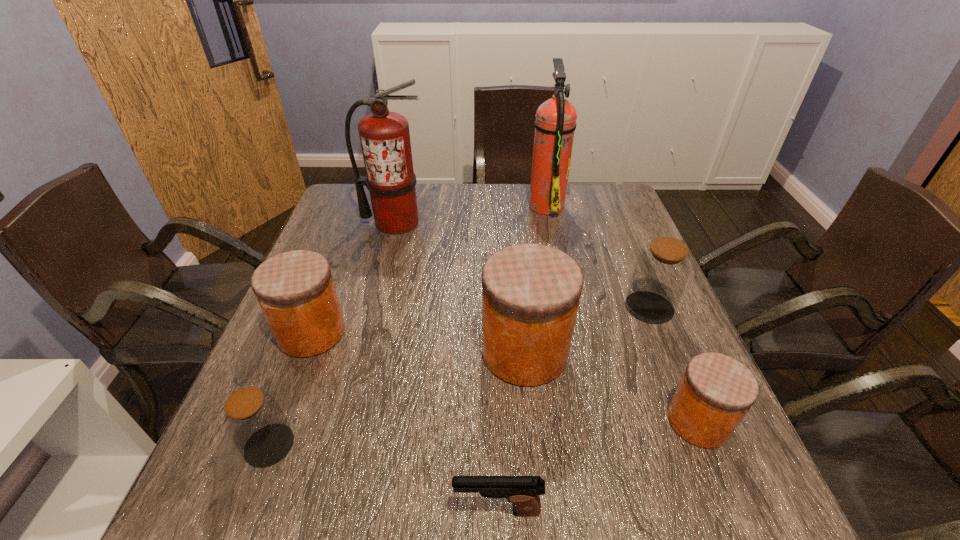
Locate an element on the screen. free space in the image that satisfies the following two spatial constraints: 1. at the nozzle of the right fire extinguisher; 2. on the right side of the bigger brown jar is located at coordinates (568, 307).

The image size is (960, 540). I want to click on free space that satisfies the following two spatial constraints: 1. toward the nozzle of the farther brown jar; 2. on the right side of the red fire extinguisher, so click(x=373, y=307).

Find the location of a particular element. The width and height of the screenshot is (960, 540). free point that satisfies the following two spatial constraints: 1. on the back side of the nearest orange jar; 2. on the right side of the smaller brown jar is located at coordinates (278, 421).